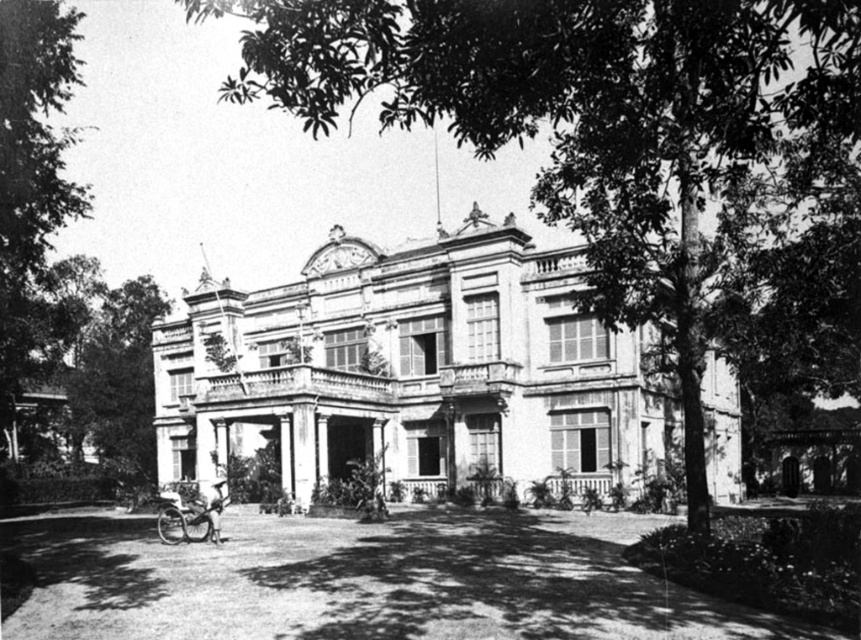
Question: Can you confirm if white stone mansion at center is positioned to the left of wooden baby carriage at lower left?

Choices:
 (A) yes
 (B) no

Answer: (B)

Question: Which of the following is the closest to the observer?

Choices:
 (A) white stone mansion at center
 (B) wooden baby carriage at lower left

Answer: (B)

Question: Which object is farther from the camera taking this photo?

Choices:
 (A) white stone mansion at center
 (B) wooden baby carriage at lower left

Answer: (A)

Question: Does white stone mansion at center have a greater width compared to wooden baby carriage at lower left?

Choices:
 (A) yes
 (B) no

Answer: (A)

Question: Which point is farther from the camera taking this photo?

Choices:
 (A) (189, 403)
 (B) (215, 524)

Answer: (A)

Question: Can you confirm if white stone mansion at center is positioned below wooden baby carriage at lower left?

Choices:
 (A) no
 (B) yes

Answer: (A)